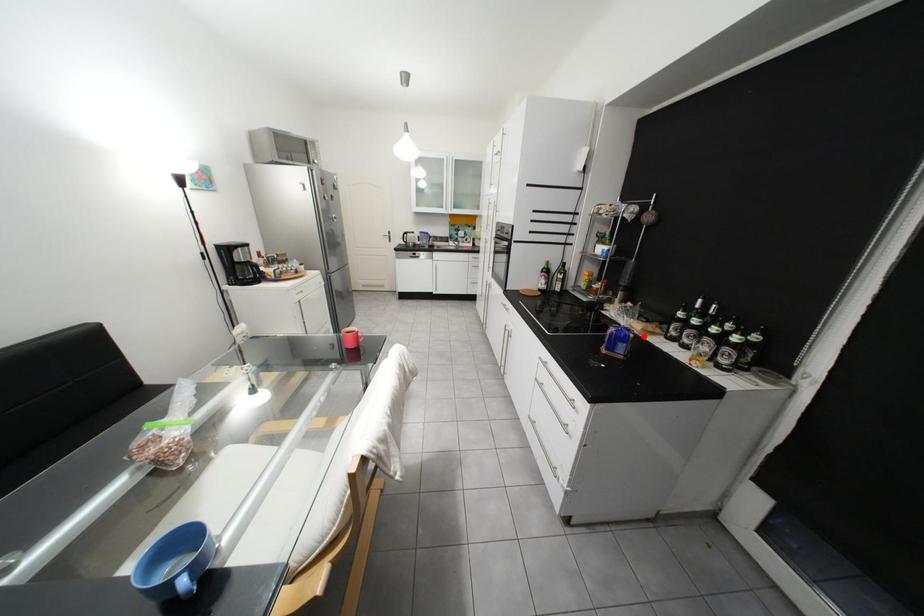
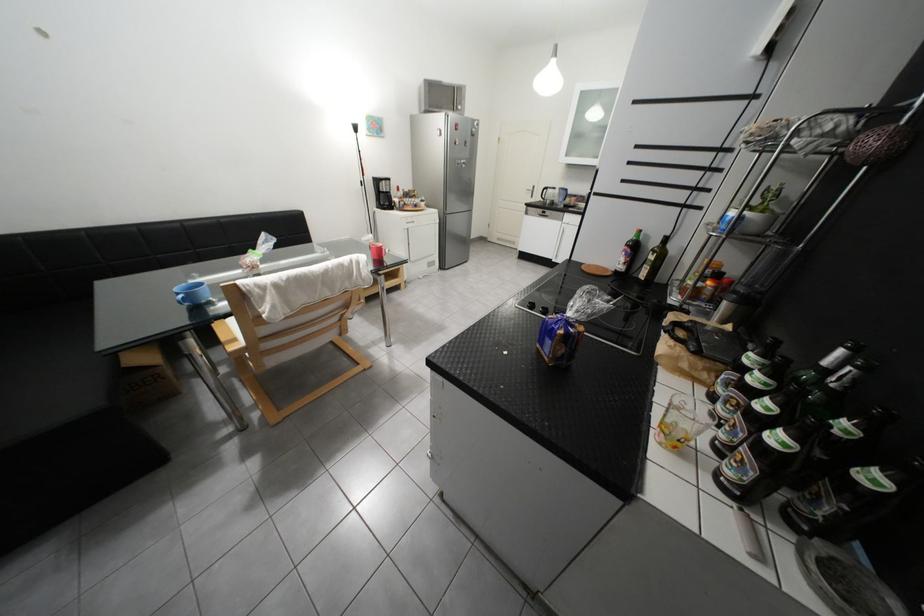
In the second image, find the point that corresponds to the highlighted location in the first image.

(574, 333)